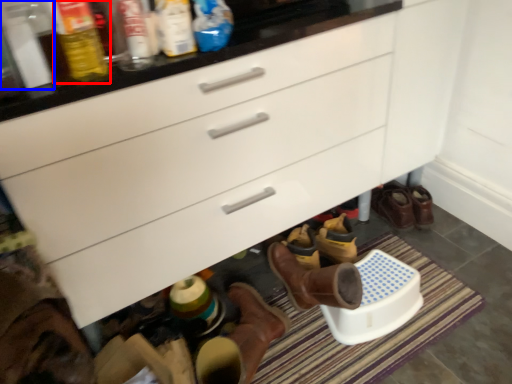
Question: Which object is closer to the camera taking this photo, bottle (highlighted by a red box) or bottle (highlighted by a blue box)?

Choices:
 (A) bottle
 (B) bottle

Answer: (A)